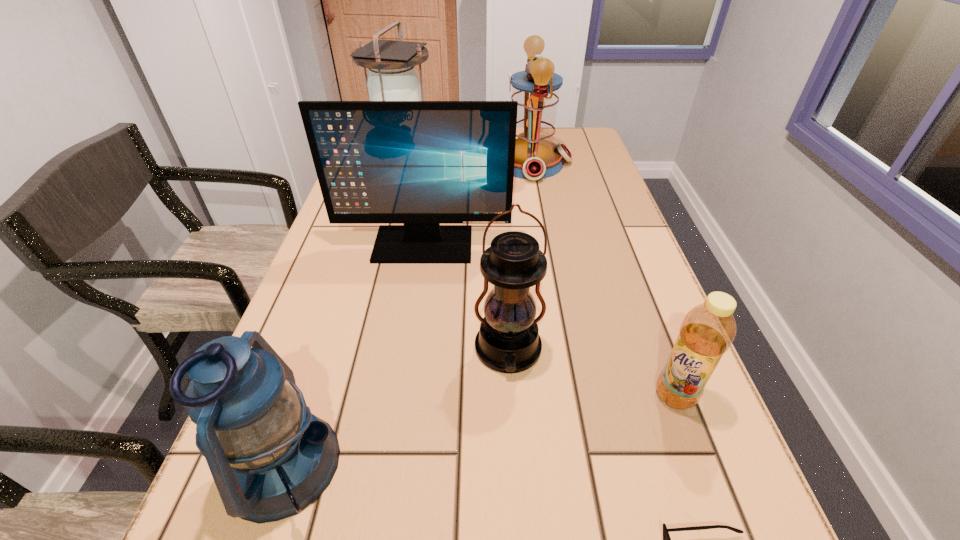
Image resolution: width=960 pixels, height=540 pixels. I want to click on the closest object to the third farthest lantern, so click(x=419, y=163).

Identify the location of lantern that is the third closest to the bottle. This screenshot has width=960, height=540. (536, 89).

Locate which lantern ranks third in proximity to the second nearest lantern. Please provide its 2D coordinates. Your answer should be formatted as a tuple, i.e. [(x, y)], where the tuple contains the x and y coordinates of a point satisfying the conditions above.

[(392, 77)]

In order to click on vacant space that satisfies the following two spatial constraints: 1. on the screen side of the monitor; 2. on the right side of the bottle in this screenshot , I will do `click(400, 395)`.